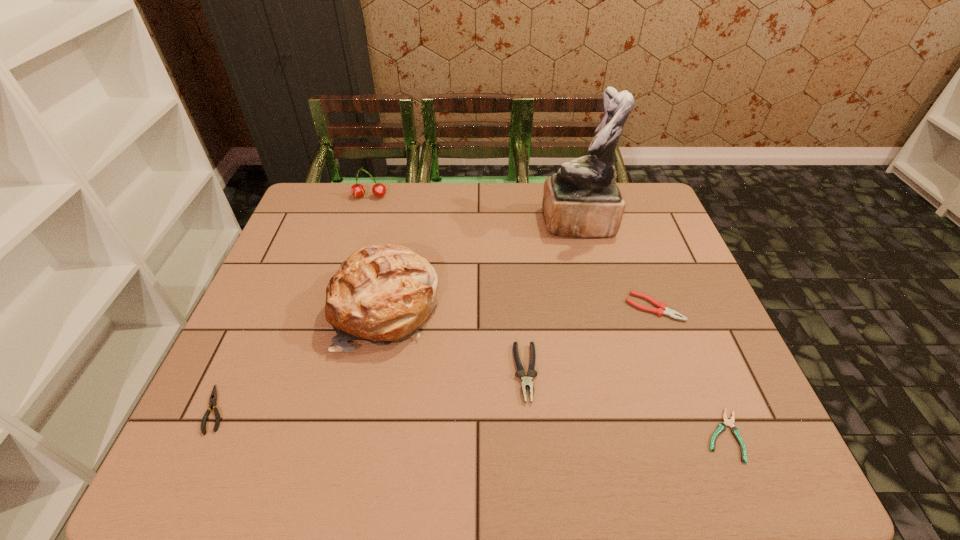
In the image, there is a desktop. In order to click on free space at the left edge in this screenshot , I will do `click(301, 280)`.

I want to click on vacant space at the right edge of the desktop, so click(x=689, y=377).

In the image, there is a desktop. Where is `vacant space at the far left corner`? vacant space at the far left corner is located at coordinates (339, 192).

Find the location of a particular element. Image resolution: width=960 pixels, height=540 pixels. vacant point at the far right corner is located at coordinates (616, 183).

You are a GUI agent. You are given a task and a screenshot of the screen. Output one action in this format:
    pyautogui.click(x=<x>, y=<y>)
    Task: Click on the empty space that is in between the farthest pliers and the second farthest object
    This screenshot has width=960, height=540.
    Given the screenshot: What is the action you would take?
    pyautogui.click(x=616, y=265)

Where is `free point between the farthest object and the third shortest pliers`? free point between the farthest object and the third shortest pliers is located at coordinates (512, 252).

I want to click on free space between the shortest pliers and the bread, so click(554, 372).

Where is `free space between the farthest object and the farthest pliers`? free space between the farthest object and the farthest pliers is located at coordinates (512, 252).

This screenshot has height=540, width=960. I want to click on vacant area that lies between the leftmost pliers and the fifth tallest object, so click(435, 359).

Find the location of `vacant area that lies between the bread and the tallest object`. vacant area that lies between the bread and the tallest object is located at coordinates (481, 266).